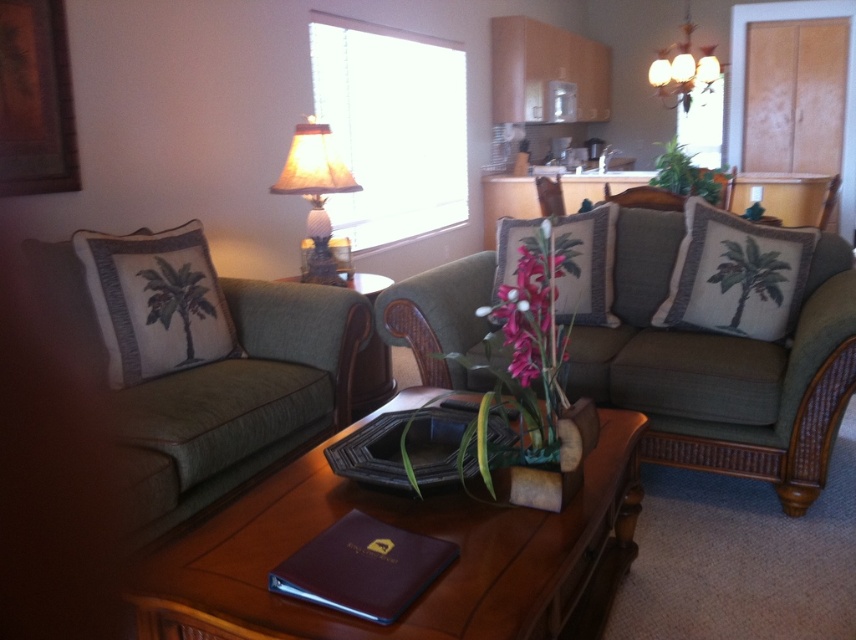
Is point (435, 364) more distant than point (539, 225)?

No, (435, 364) is in front of (539, 225).

Who is more distant from viewer, (455, 349) or (563, 349)?

The point (455, 349) is more distant.

Describe the element at coordinates (723, 369) in the screenshot. This screenshot has width=856, height=640. I see `green fabric couch at center` at that location.

Locate an element on the screen. green fabric couch at center is located at coordinates (723, 369).

Who is lower down, brown wood table at center or pink silk flower at center?

Positioned lower is brown wood table at center.

Who is taller, brown wood table at center or pink silk flower at center?

brown wood table at center is taller.

The height and width of the screenshot is (640, 856). Find the location of `brown wood table at center`. brown wood table at center is located at coordinates (407, 529).

Between green fabric couch at center and floral fabric pillow at center, which one has less height?

Standing shorter between the two is floral fabric pillow at center.

Who is positioned more to the right, green fabric couch at center or floral fabric pillow at center?

green fabric couch at center is more to the right.

Which is behind, point (574, 396) or point (611, 204)?

The point (611, 204) is behind.

Locate an element on the screen. This screenshot has width=856, height=640. green fabric couch at center is located at coordinates (723, 369).